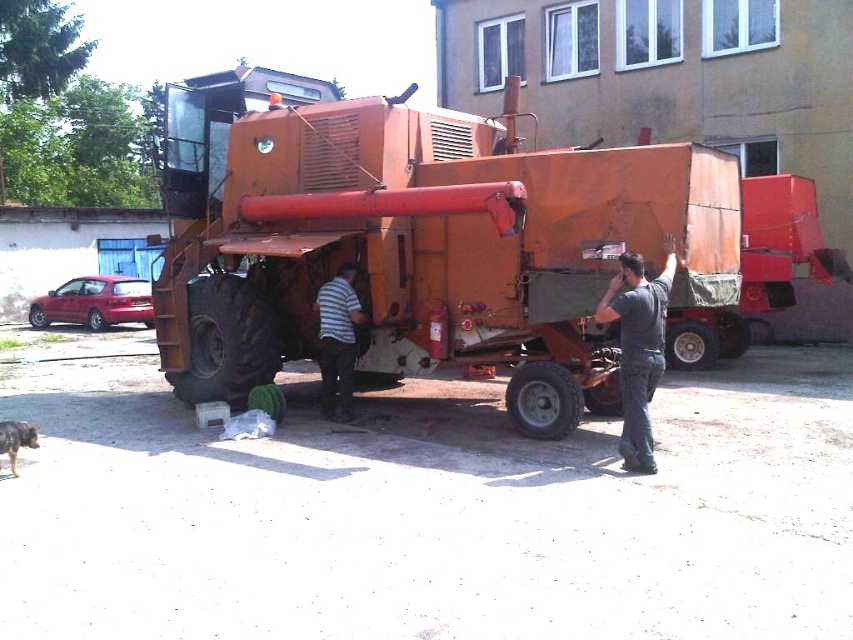
You are standing in front of the rusty metal tractor at center and the striped shirt at center. Which object is closer to you?

The rusty metal tractor at center is closer to you than the striped shirt at center because it is further to the viewer.

In the scene shown: You are standing in front of the combine harvester and notice two people nearby. One is wearing a dark gray shirt at center and the other a striped shirt at center. Which person is closer to you?

The dark gray shirt at center is closer to the viewer than the striped shirt at center, so the person in the dark gray shirt at center is closer to you.